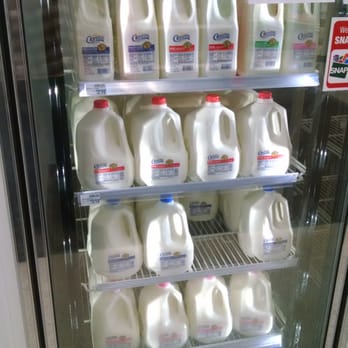
Locate an element on the screen. The height and width of the screenshot is (348, 348). milk on bottom shelf, front row is located at coordinates (109, 312), (161, 308), (211, 297), (240, 294).